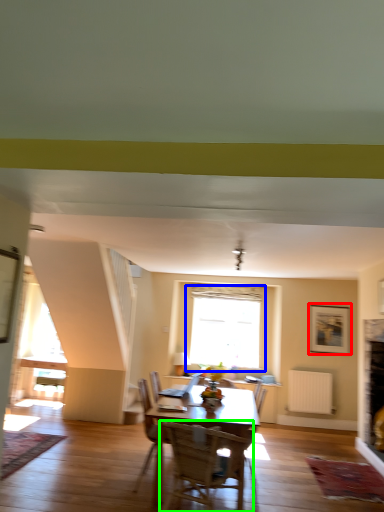
Question: Which object is positioned farthest from picture frame (highlighted by a red box)? Select from window (highlighted by a blue box) and chair (highlighted by a green box).

Choices:
 (A) window
 (B) chair

Answer: (B)